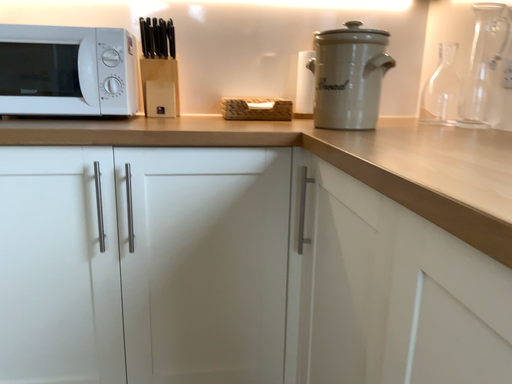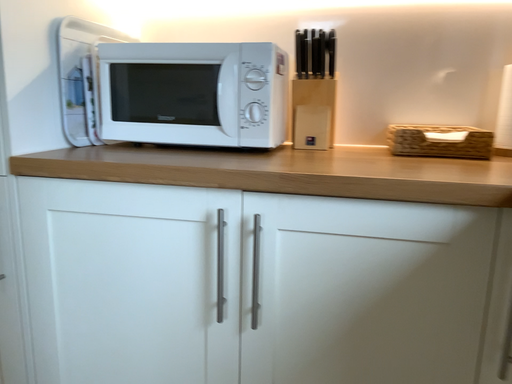
Question: Which way did the camera rotate in the video?

Choices:
 (A) rotated left
 (B) rotated right

Answer: (A)